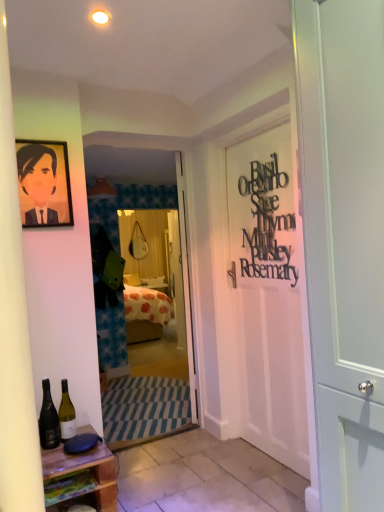
Question: Is white tile at lower center not near dark green glass bottle at lower left, which is the 1th bottle from left to right?

Choices:
 (A) yes
 (B) no

Answer: (B)

Question: Can you see white tile at lower center touching dark green glass bottle at lower left, which is the 1th bottle from left to right?

Choices:
 (A) no
 (B) yes

Answer: (A)

Question: Does white tile at lower center lie in front of dark green glass bottle at lower left, which is the second bottle from right to left?

Choices:
 (A) no
 (B) yes

Answer: (B)

Question: From the image's perspective, does white tile at lower center appear lower than dark green glass bottle at lower left, which is the 1th bottle from left to right?

Choices:
 (A) no
 (B) yes

Answer: (B)

Question: Is the depth of white tile at lower center greater than that of dark green glass bottle at lower left, which is the 1th bottle from left to right?

Choices:
 (A) yes
 (B) no

Answer: (B)

Question: From their relative heights in the image, would you say white tile at lower center is taller or shorter than dark green glass bottle at lower left, which is the 1th bottle from left to right?

Choices:
 (A) tall
 (B) short

Answer: (B)

Question: Do you think white tile at lower center is within dark green glass bottle at lower left, which is the 1th bottle from left to right, or outside of it?

Choices:
 (A) outside
 (B) inside

Answer: (A)

Question: Visually, is white tile at lower center positioned to the left or to the right of dark green glass bottle at lower left, which is the second bottle from right to left?

Choices:
 (A) right
 (B) left

Answer: (A)

Question: From a real-world perspective, is white tile at lower center positioned above or below dark green glass bottle at lower left, which is the second bottle from right to left?

Choices:
 (A) below
 (B) above

Answer: (A)

Question: Looking at the image, does dark green glass bottle at lower left, which is the 1th bottle from left to right, seem bigger or smaller compared to white tile at lower center?

Choices:
 (A) small
 (B) big

Answer: (A)

Question: From the image's perspective, is dark green glass bottle at lower left, which is the 1th bottle from left to right, located above or below white tile at lower center?

Choices:
 (A) above
 (B) below

Answer: (A)

Question: Visually, is dark green glass bottle at lower left, which is the 1th bottle from left to right, positioned to the left or to the right of white tile at lower center?

Choices:
 (A) left
 (B) right

Answer: (A)

Question: Looking at their shapes, would you say dark green glass bottle at lower left, which is the second bottle from right to left, is wider or thinner than white tile at lower center?

Choices:
 (A) thin
 (B) wide

Answer: (A)

Question: Looking at their shapes, would you say white tile at lower center is wider or thinner than white wooden door at center, the first door positioned from the back?

Choices:
 (A) wide
 (B) thin

Answer: (A)

Question: Considering the positions of point (205, 465) and point (195, 408), is point (205, 465) closer or farther from the camera than point (195, 408)?

Choices:
 (A) farther
 (B) closer

Answer: (B)